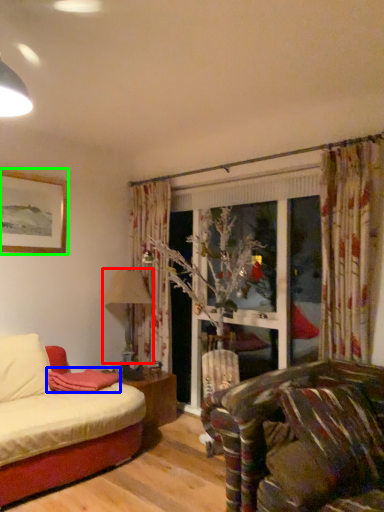
Question: Which is farther away from lamp (highlighted by a red box)? blanket (highlighted by a blue box) or picture frame (highlighted by a green box)?

Choices:
 (A) blanket
 (B) picture frame

Answer: (B)